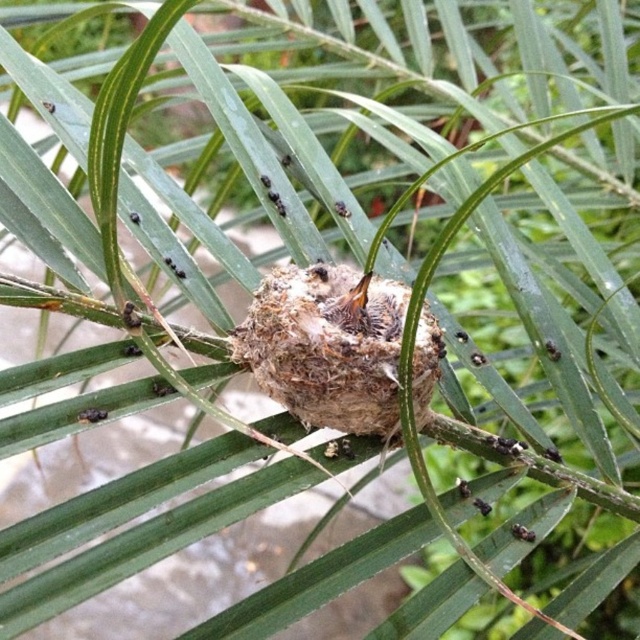
Question: Is brown fuzzy nest at center positioned in front of black glossy ant at center?

Choices:
 (A) no
 (B) yes

Answer: (B)

Question: Which of the following is the farthest from the observer?

Choices:
 (A) brown fuzzy nest at center
 (B) black matte ant at center

Answer: (B)

Question: Which object is the farthest from the black matte ant at center?

Choices:
 (A) brown fuzzy nest at center
 (B) black glossy ant at center

Answer: (A)

Question: Does brown fuzzy nest at center have a greater width compared to black glossy ant at center?

Choices:
 (A) yes
 (B) no

Answer: (A)

Question: Which point is closer to the camera?

Choices:
 (A) (488, 513)
 (B) (285, 316)
 (C) (516, 529)

Answer: (B)

Question: Does black glossy ant at center appear over black matte ant at center?

Choices:
 (A) yes
 (B) no

Answer: (B)